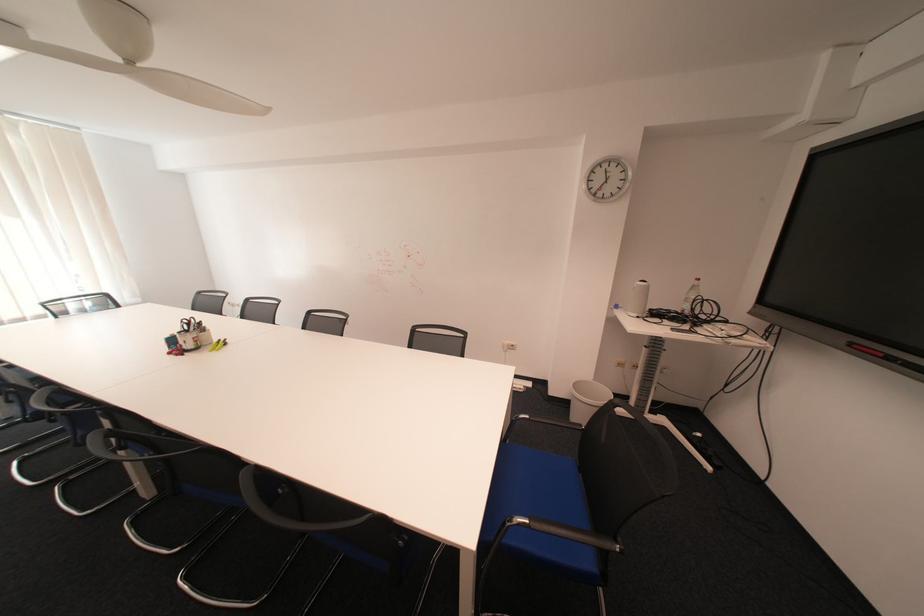
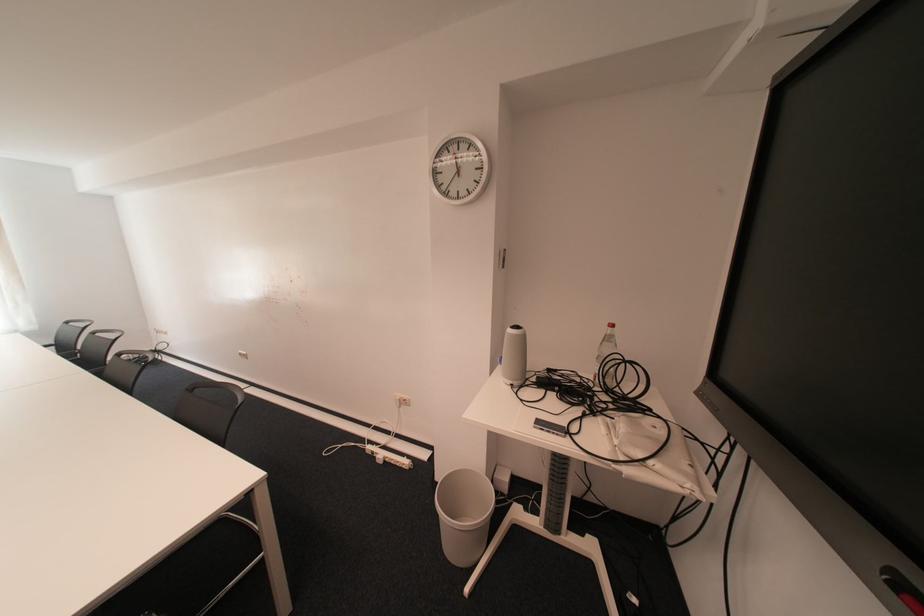
In the second image, find the point that corresponds to (x=701, y=290) in the first image.

(614, 341)